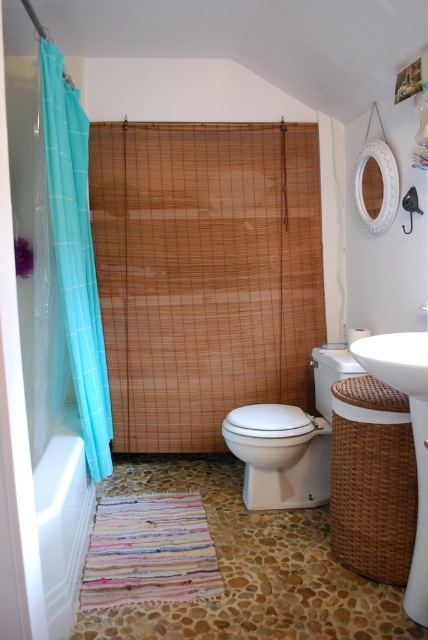
You are standing in the bathroom and want to place a small potted plant on the floor. The potted plant is 15 cm tall. Is there enough space between the transparent plastic screen door at left and the white glossy towel at lower left to place the plant without it touching either object?

The transparent plastic screen door at left is located above the white glossy towel at lower left. Since the door is above the towel, there is vertical space between them. The plant, being 15 cm tall, can be placed on the floor between them without touching either object as long as it is positioned below the door and above the towel.

You are standing in the bathroom and want to hang a new towel rack. The bamboo curtain at center is in the way. Where should you place the rack to avoid the curtain?

The bamboo curtain at center is located at point [205,273], so place the towel rack in an area not overlapping with these coordinates to avoid the curtain.

You are standing in the bathroom and want to hang a new hook on the wall behind the bamboo curtain at center and the white glossy towel at lower left. Which object should you move first to access the wall?

You should move the bamboo curtain at center first because it is closer to you than the white glossy towel at lower left, so it is blocking the wall behind it.